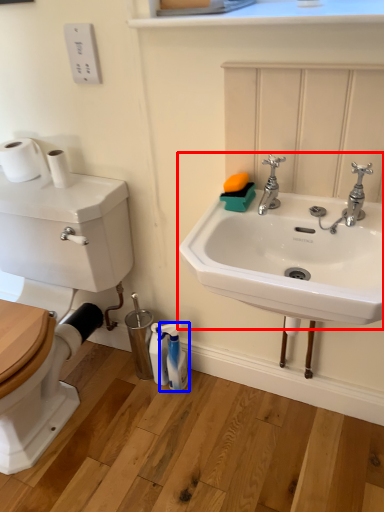
Question: Which of the following is the farthest to the observer, sink (highlighted by a red box) or cleaning product (highlighted by a blue box)?

Choices:
 (A) sink
 (B) cleaning product

Answer: (B)